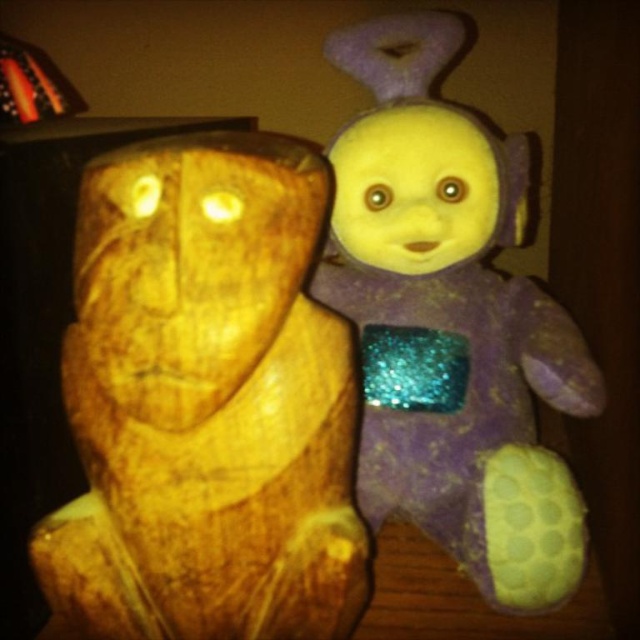
Question: Does wooden carving at left have a greater width compared to purple glittery plush at upper right?

Choices:
 (A) no
 (B) yes

Answer: (A)

Question: Which point appears closest to the camera in this image?

Choices:
 (A) (451, 538)
 (B) (88, 605)

Answer: (B)

Question: Is wooden carving at left smaller than purple glittery plush at upper right?

Choices:
 (A) yes
 (B) no

Answer: (A)

Question: Which point is closer to the camera taking this photo?

Choices:
 (A) (470, 227)
 (B) (241, 582)

Answer: (B)

Question: Does wooden carving at left appear on the right side of purple glittery plush at upper right?

Choices:
 (A) no
 (B) yes

Answer: (A)